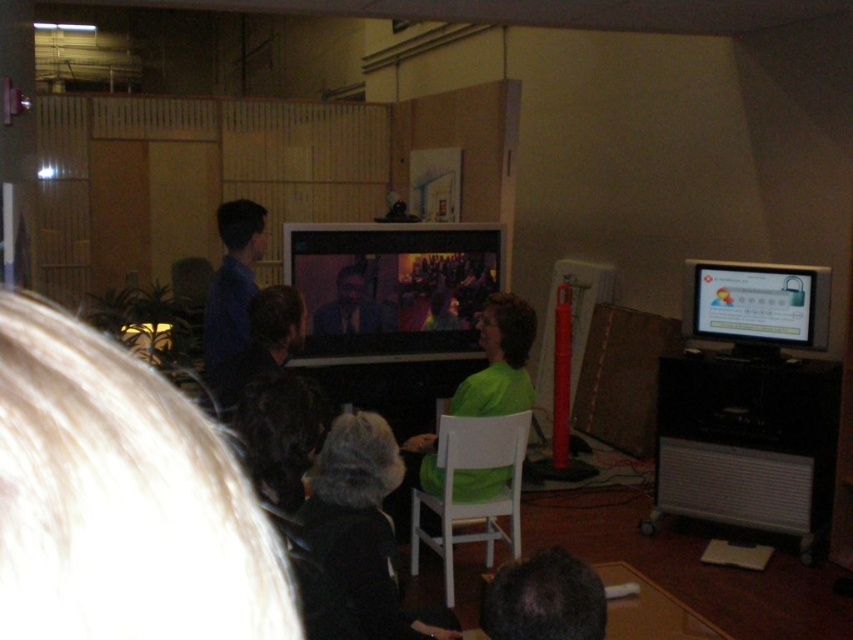
Which is below, dark gray knit hat at lower center or white plastic chair at center?

white plastic chair at center is below.

Does dark gray knit hat at lower center appear on the left side of white plastic chair at center?

Yes, dark gray knit hat at lower center is to the left of white plastic chair at center.

The image size is (853, 640). What do you see at coordinates (363, 528) in the screenshot?
I see `dark gray knit hat at lower center` at bounding box center [363, 528].

Where is `dark gray knit hat at lower center`? The image size is (853, 640). dark gray knit hat at lower center is located at coordinates (363, 528).

Can you confirm if white plastic chair at center is shorter than matte black shirt at center?

In fact, white plastic chair at center may be taller than matte black shirt at center.

In the scene shown: Between white plastic chair at center and matte black shirt at center, which one appears on the right side from the viewer's perspective?

white plastic chair at center

Is point (453, 586) closer to viewer compared to point (386, 307)?

That is True.

What are the coordinates of `white plastic chair at center` in the screenshot? It's located at (476, 500).

Based on the photo, measure the distance between dark brown hair at center and matte black shirt at center.

dark brown hair at center is 3.41 meters away from matte black shirt at center.

Can you confirm if dark brown hair at center is smaller than matte black shirt at center?

Yes.

Which is behind, point (86, 460) or point (390, 324)?

Point (390, 324)

I want to click on dark brown hair at center, so click(x=120, y=499).